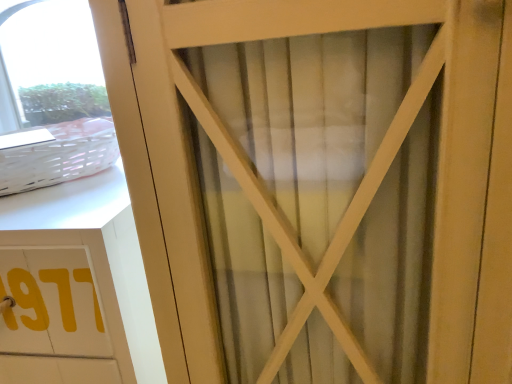
This screenshot has width=512, height=384. Describe the element at coordinates (76, 287) in the screenshot. I see `white matte cabinet at left` at that location.

I want to click on white matte cabinet at left, so click(76, 287).

The width and height of the screenshot is (512, 384). Describe the element at coordinates (60, 156) in the screenshot. I see `white woven basket at upper left` at that location.

The image size is (512, 384). In order to click on white woven basket at upper left in this screenshot , I will do `click(60, 156)`.

Find the location of a particular element. This screenshot has width=512, height=384. white matte cabinet at left is located at coordinates (76, 287).

Considering the relative positions of white woven basket at upper left and white matte cabinet at left in the image provided, is white woven basket at upper left to the right of white matte cabinet at left from the viewer's perspective?

Yes, white woven basket at upper left is to the right of white matte cabinet at left.

Considering the relative positions of white woven basket at upper left and white matte cabinet at left in the image provided, is white woven basket at upper left in front of white matte cabinet at left?

No, white woven basket at upper left is further to the viewer.

Is point (0, 181) closer or farther from the camera than point (0, 257)?

Point (0, 181) appears to be farther away from the viewer than point (0, 257).

From the image's perspective, which one is positioned higher, white woven basket at upper left or white matte cabinet at left?

white woven basket at upper left, from the image's perspective.

From a real-world perspective, is white woven basket at upper left physically located above or below white matte cabinet at left?

white woven basket at upper left is situated higher than white matte cabinet at left in the real world.

Which object is thinner, white woven basket at upper left or white matte cabinet at left?

With smaller width is white woven basket at upper left.

Does white woven basket at upper left have a lesser height compared to white matte cabinet at left?

Correct, white woven basket at upper left is not as tall as white matte cabinet at left.

Considering the relative sizes of white woven basket at upper left and white matte cabinet at left in the image provided, is white woven basket at upper left bigger than white matte cabinet at left?

No, white woven basket at upper left is not bigger than white matte cabinet at left.

Is white matte cabinet at left located within white woven basket at upper left?

No, white matte cabinet at left is not a part of white woven basket at upper left.

Are white woven basket at upper left and white matte cabinet at left far apart?

No.

Is white woven basket at upper left turned away from white matte cabinet at left?

white woven basket at upper left does not have its back to white matte cabinet at left.

What's the angular difference between white woven basket at upper left and white matte cabinet at left's facing directions?

2.27e-05 degrees separate the facing orientations of white woven basket at upper left and white matte cabinet at left.

At what (x,y) coordinates should I click in order to perform the action: click on cabinetry that is below the white woven basket at upper left (from the image's perspective). Please return your answer as a coordinate pair (x, y). The height and width of the screenshot is (384, 512). Looking at the image, I should click on (76, 287).

Between white matte cabinet at left and white woven basket at upper left, which one appears on the right side from the viewer's perspective?

white woven basket at upper left.

Which object is more forward, white matte cabinet at left or white woven basket at upper left?

white matte cabinet at left is closer to the camera.

Which is closer, (13, 375) or (65, 173)?

The point (13, 375) is closer to the camera.

From the image's perspective, is white matte cabinet at left under white woven basket at upper left?

Yes.

From a real-world perspective, is white matte cabinet at left positioned above or below white woven basket at upper left?

In terms of real-world spatial position, white matte cabinet at left is below white woven basket at upper left.

Which of these two, white matte cabinet at left or white woven basket at upper left, is wider?

white matte cabinet at left.

Is white matte cabinet at left taller than white woven basket at upper left?

Indeed, white matte cabinet at left has a greater height compared to white woven basket at upper left.

Looking at the image, does white matte cabinet at left seem bigger or smaller compared to white woven basket at upper left?

Considering their sizes, white matte cabinet at left takes up more space than white woven basket at upper left.

Is white matte cabinet at left outside of white woven basket at upper left?

white matte cabinet at left is positioned outside white woven basket at upper left.

Is white matte cabinet at left beside white woven basket at upper left?

No.

Could you tell me if white matte cabinet at left is turned towards white woven basket at upper left?

No, white matte cabinet at left does not turn towards white woven basket at upper left.

Find the location of a particular element. Image resolution: width=512 pixels, height=384 pixels. cabinetry below the white woven basket at upper left (from a real-world perspective) is located at coordinates (76, 287).

At what (x,y) coordinates should I click in order to perform the action: click on basket above the white matte cabinet at left (from the image's perspective). Please return your answer as a coordinate pair (x, y). This screenshot has width=512, height=384. Looking at the image, I should click on (60, 156).

Where is `cabinetry below the white woven basket at upper left (from the image's perspective)`? The width and height of the screenshot is (512, 384). cabinetry below the white woven basket at upper left (from the image's perspective) is located at coordinates (76, 287).